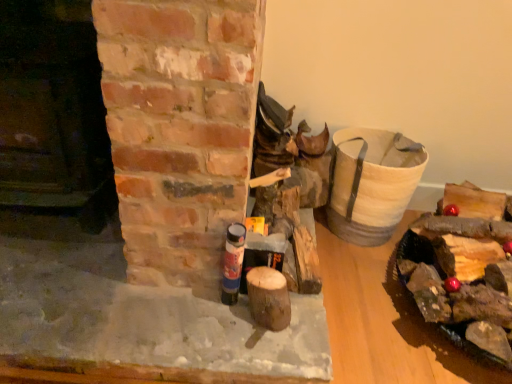
Question: Considering the positions of smooth dark brown wood at left, placed as the 2th fireplace when sorted from bottom to top, and smooth brick fireplace at center, which appears as the first fireplace when ordered from the bottom, in the image, is smooth dark brown wood at left, placed as the 2th fireplace when sorted from bottom to top, taller or shorter than smooth brick fireplace at center, which appears as the first fireplace when ordered from the bottom,?

Choices:
 (A) short
 (B) tall

Answer: (B)

Question: Is smooth dark brown wood at left, which ranks as the 1th fireplace in top-to-bottom order, bigger or smaller than smooth brick fireplace at center, the second fireplace in the top-to-bottom sequence?

Choices:
 (A) big
 (B) small

Answer: (A)

Question: Which object is positioned closest to the smooth brick fireplace at center, which appears as the first fireplace when ordered from the bottom?

Choices:
 (A) wooden logs at right
 (B) smooth dark brown wood at left, placed as the 2th fireplace when sorted from bottom to top
 (C) blue matte spray can at center

Answer: (C)

Question: Which object is positioned closest to the blue matte spray can at center?

Choices:
 (A) smooth brick fireplace at center, the second fireplace in the top-to-bottom sequence
 (B) wooden logs at right
 (C) smooth dark brown wood at left, which ranks as the 1th fireplace in top-to-bottom order

Answer: (A)